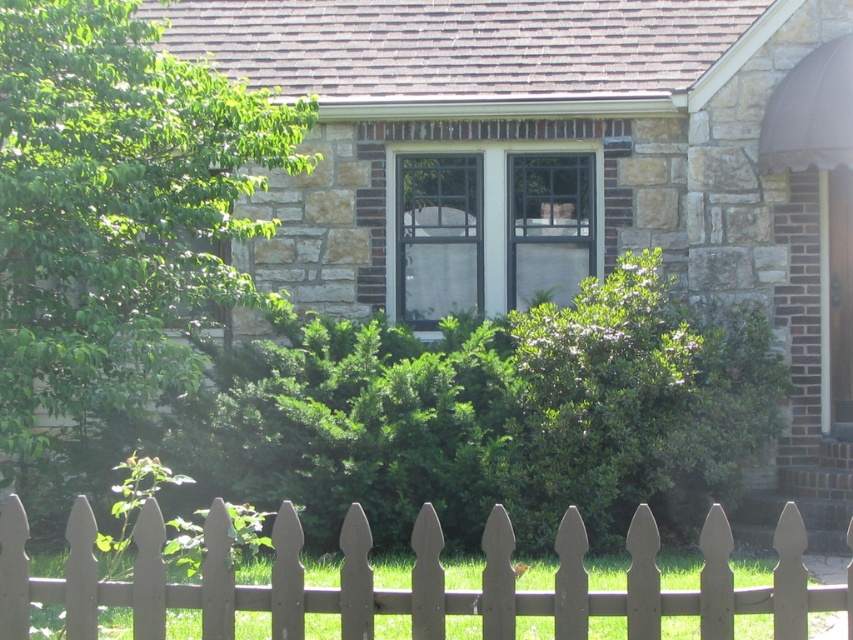
Where is `white picket fence at center`? The image size is (853, 640). white picket fence at center is located at coordinates (410, 580).

Find the location of a particular element. white picket fence at center is located at coordinates (410, 580).

Is clear glass window at center positioned at the back of transparent glass screen door at right?

Yes, it is behind transparent glass screen door at right.

Which is in front, point (422, 163) or point (836, 348)?

Positioned in front is point (836, 348).

Image resolution: width=853 pixels, height=640 pixels. What are the coordinates of `clear glass window at center` in the screenshot? It's located at (489, 228).

Where is `clear glass window at center`? This screenshot has height=640, width=853. clear glass window at center is located at coordinates (489, 228).

The width and height of the screenshot is (853, 640). Describe the element at coordinates (410, 580) in the screenshot. I see `white picket fence at center` at that location.

Is the position of white picket fence at center more distant than that of transparent glass screen door at right?

No, white picket fence at center is in front of transparent glass screen door at right.

Is point (570, 614) closer to viewer compared to point (828, 284)?

Yes, point (570, 614) is closer to viewer.

At what (x,y) coordinates should I click in order to perform the action: click on white picket fence at center. Please return your answer as a coordinate pair (x, y). This screenshot has width=853, height=640. Looking at the image, I should click on (410, 580).